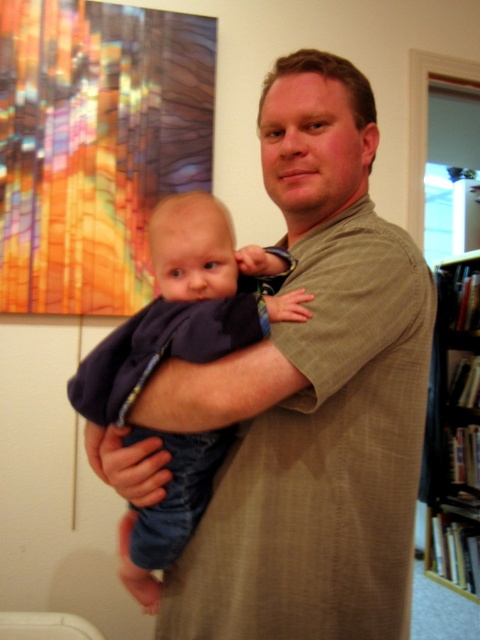
Question: Is matte khaki shirt at center below dark blue fabric at center?

Choices:
 (A) yes
 (B) no

Answer: (B)

Question: Is the position of matte khaki shirt at center more distant than that of dark blue fabric at center?

Choices:
 (A) no
 (B) yes

Answer: (A)

Question: Estimate the real-world distances between objects in this image. Which object is closer to the black wood bookshelf at right?

Choices:
 (A) dark blue fabric at center
 (B) matte khaki shirt at center

Answer: (B)

Question: Which of the following is the farthest from the observer?

Choices:
 (A) (471, 401)
 (B) (162, 260)

Answer: (A)

Question: Does matte khaki shirt at center lie behind black wood bookshelf at right?

Choices:
 (A) no
 (B) yes

Answer: (A)

Question: Estimate the real-world distances between objects in this image. Which object is closer to the matte khaki shirt at center?

Choices:
 (A) black wood bookshelf at right
 (B) dark blue fabric at center

Answer: (B)